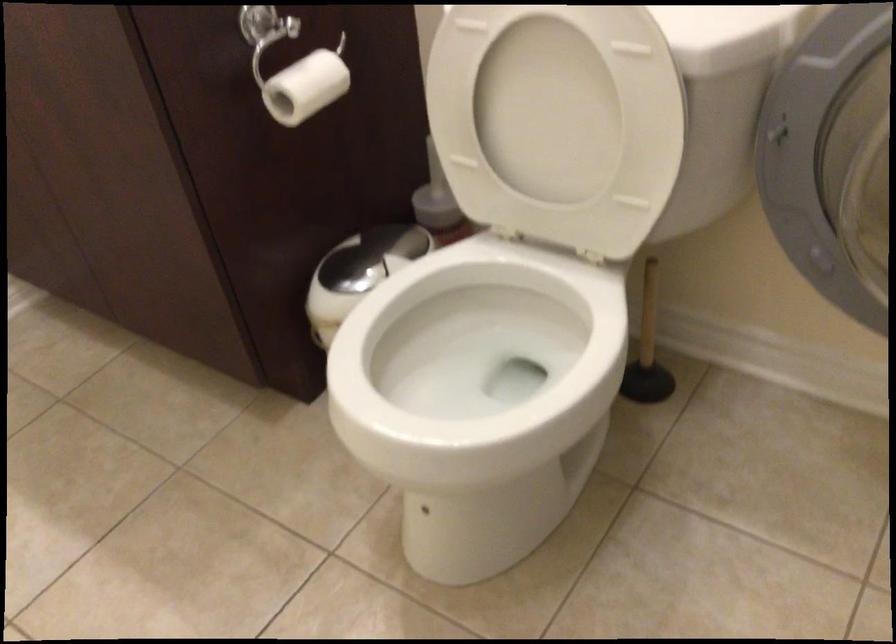
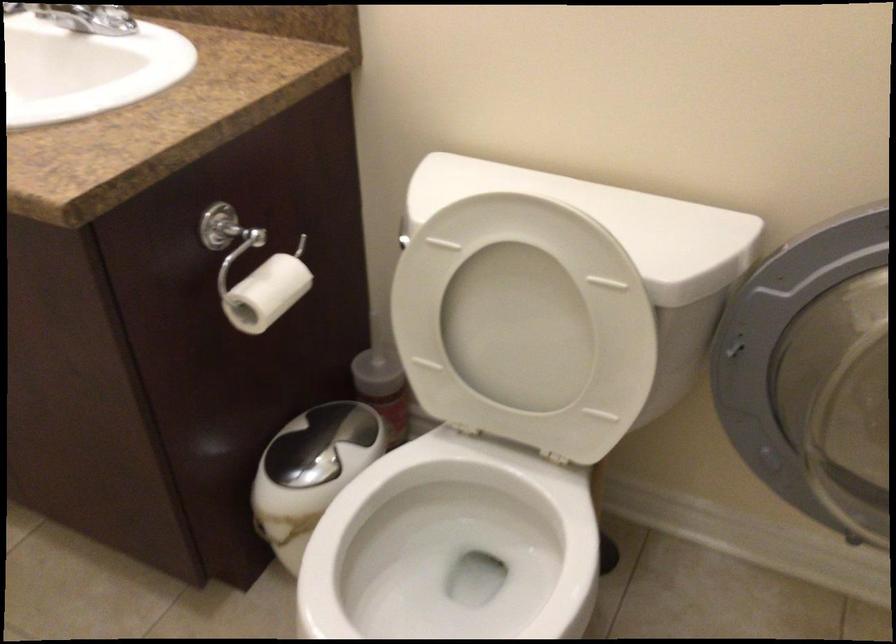
Find the pixel in the second image that matches point 297,77 in the first image.

(263, 286)